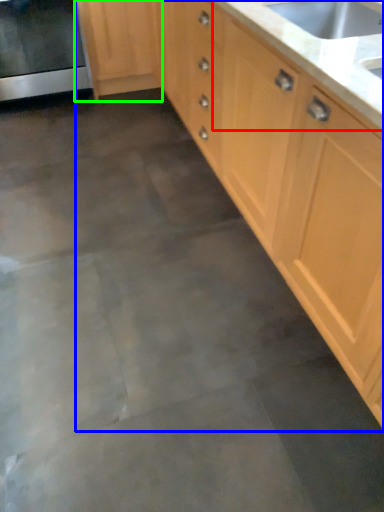
Question: Which is nearer to the countertop (highlighted by a red box)? cabinetry (highlighted by a blue box) or cabinetry (highlighted by a green box).

Choices:
 (A) cabinetry
 (B) cabinetry

Answer: (A)